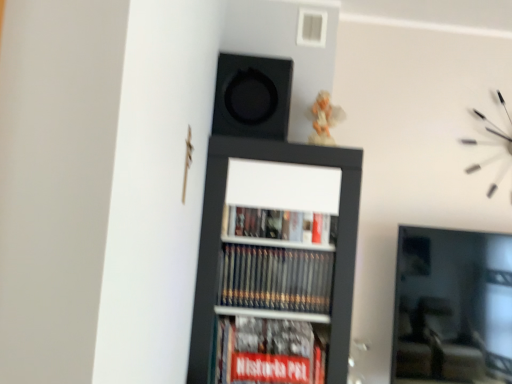
Question: Is black matte speaker at upper center further to the viewer compared to black matte bookcase at center?

Choices:
 (A) no
 (B) yes

Answer: (B)

Question: Can you confirm if black matte speaker at upper center is positioned to the right of black matte bookcase at center?

Choices:
 (A) no
 (B) yes

Answer: (A)

Question: Does black matte speaker at upper center come in front of black matte bookcase at center?

Choices:
 (A) no
 (B) yes

Answer: (A)

Question: Can you confirm if black matte speaker at upper center is taller than black matte bookcase at center?

Choices:
 (A) yes
 (B) no

Answer: (B)

Question: Does black matte speaker at upper center appear on the left side of black matte bookcase at center?

Choices:
 (A) yes
 (B) no

Answer: (A)

Question: Can you see black matte speaker at upper center touching black matte bookcase at center?

Choices:
 (A) yes
 (B) no

Answer: (B)

Question: Can you confirm if black matte bookcase at center is shorter than black matte speaker at upper center?

Choices:
 (A) yes
 (B) no

Answer: (B)

Question: Considering the relative sizes of black matte bookcase at center and black matte speaker at upper center in the image provided, is black matte bookcase at center thinner than black matte speaker at upper center?

Choices:
 (A) no
 (B) yes

Answer: (A)

Question: Is black matte bookcase at center smaller than black matte speaker at upper center?

Choices:
 (A) yes
 (B) no

Answer: (B)

Question: From a real-world perspective, is black matte bookcase at center on top of black matte speaker at upper center?

Choices:
 (A) no
 (B) yes

Answer: (A)

Question: Is black matte bookcase at center oriented away from black matte speaker at upper center?

Choices:
 (A) no
 (B) yes

Answer: (A)

Question: Is black matte bookcase at center directly adjacent to black matte speaker at upper center?

Choices:
 (A) yes
 (B) no

Answer: (B)

Question: Is white matte clock at upper right thinner than black matte speaker at upper center?

Choices:
 (A) yes
 (B) no

Answer: (A)